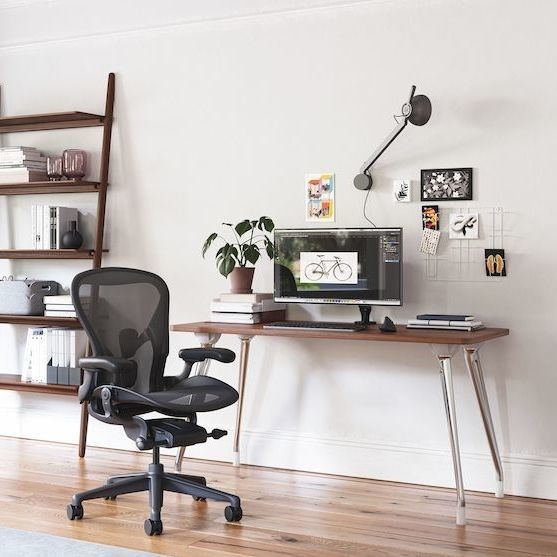
Where is `wall`? This screenshot has height=557, width=557. wall is located at coordinates (244, 173).